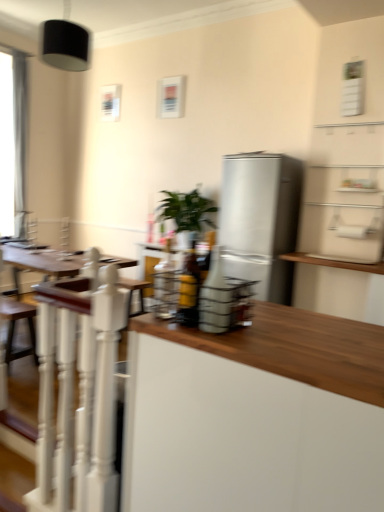
Question: Is black matte lampshade at upper left not near satin silver refrigerator at center?

Choices:
 (A) yes
 (B) no

Answer: (A)

Question: From the image's perspective, is black matte lampshade at upper left above satin silver refrigerator at center?

Choices:
 (A) no
 (B) yes

Answer: (B)

Question: From a real-world perspective, is black matte lampshade at upper left under satin silver refrigerator at center?

Choices:
 (A) no
 (B) yes

Answer: (A)

Question: Does black matte lampshade at upper left have a greater height compared to satin silver refrigerator at center?

Choices:
 (A) no
 (B) yes

Answer: (A)

Question: From the image's perspective, is black matte lampshade at upper left beneath satin silver refrigerator at center?

Choices:
 (A) no
 (B) yes

Answer: (A)

Question: Which is correct: green leafy plant at center is inside satin silver refrigerator at center, or outside of it?

Choices:
 (A) outside
 (B) inside

Answer: (A)

Question: Is green leafy plant at center bigger or smaller than satin silver refrigerator at center?

Choices:
 (A) small
 (B) big

Answer: (A)

Question: Would you say green leafy plant at center is to the left or to the right of satin silver refrigerator at center in the picture?

Choices:
 (A) right
 (B) left

Answer: (B)

Question: Looking at their shapes, would you say green leafy plant at center is wider or thinner than satin silver refrigerator at center?

Choices:
 (A) wide
 (B) thin

Answer: (B)

Question: Is point (175, 211) closer or farther from the camera than point (66, 481)?

Choices:
 (A) closer
 (B) farther

Answer: (B)

Question: Is green leafy plant at center spatially inside white painted wood railing at left, or outside of it?

Choices:
 (A) outside
 (B) inside

Answer: (A)

Question: Considering the positions of green leafy plant at center and white painted wood railing at left in the image, is green leafy plant at center taller or shorter than white painted wood railing at left?

Choices:
 (A) short
 (B) tall

Answer: (A)

Question: Is green leafy plant at center bigger or smaller than white painted wood railing at left?

Choices:
 (A) big
 (B) small

Answer: (A)

Question: From the image's perspective, is black matte lampshade at upper left positioned above or below white matte cabinet at center?

Choices:
 (A) below
 (B) above

Answer: (B)

Question: Is black matte lampshade at upper left taller or shorter than white matte cabinet at center?

Choices:
 (A) short
 (B) tall

Answer: (A)